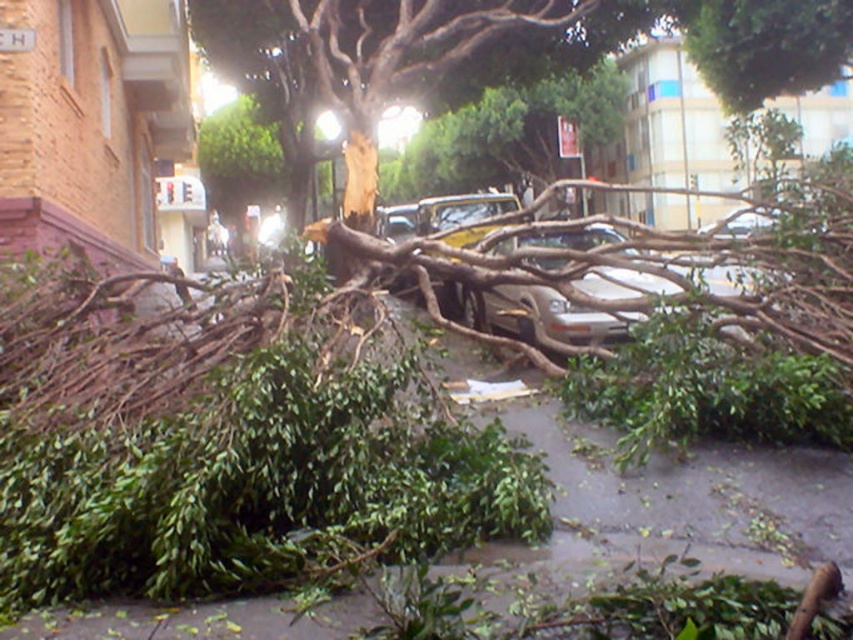
Does green leafy debris at center have a greater width compared to brown rough bark tree at center?

No.

Between green leafy debris at center and brown rough bark tree at center, which one appears on the left side from the viewer's perspective?

From the viewer's perspective, green leafy debris at center appears more on the left side.

Does point (416, 428) come closer to viewer compared to point (518, 49)?

Yes, point (416, 428) is in front of point (518, 49).

You are a GUI agent. You are given a task and a screenshot of the screen. Output one action in this format:
    pyautogui.click(x=<x>, y=<y>)
    Task: Click on the green leafy debris at center
    The image size is (853, 640).
    Given the screenshot: What is the action you would take?
    pyautogui.click(x=258, y=483)